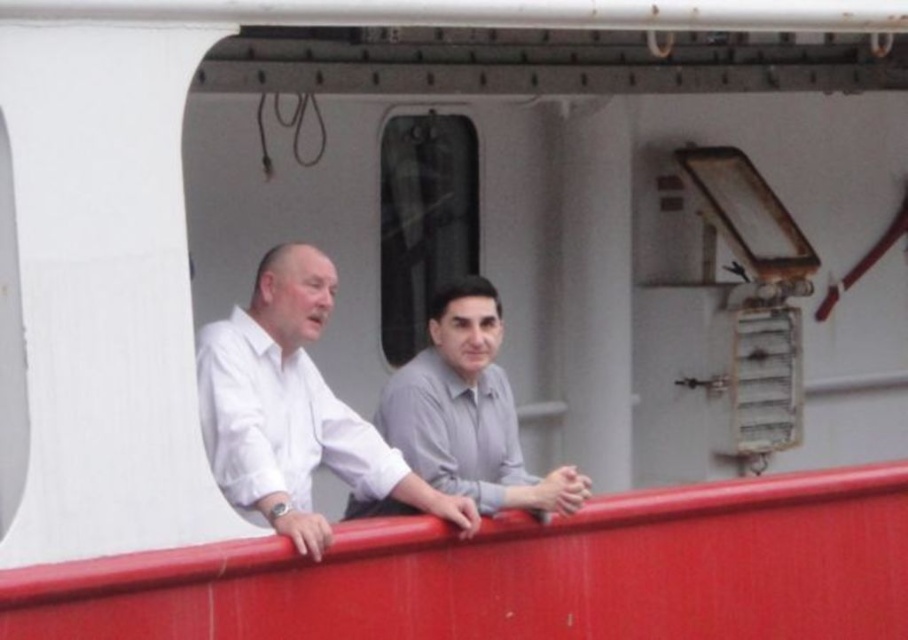
Is smooth glossy red rail at center further to camera compared to gray matte shirt at center?

That is False.

Which is more to the left, smooth glossy red rail at center or gray matte shirt at center?

Positioned to the left is gray matte shirt at center.

Who is more distant from viewer, (601, 531) or (522, 496)?

Positioned behind is point (601, 531).

At what (x,y) coordinates should I click in order to perform the action: click on smooth glossy red rail at center. Please return your answer as a coordinate pair (x, y). Looking at the image, I should click on (521, 573).

Is white matte shirt at center taller than gray matte shirt at center?

Indeed, white matte shirt at center has a greater height compared to gray matte shirt at center.

Who is more forward, (314, 436) or (511, 435)?

Point (314, 436)

Locate an element on the screen. The width and height of the screenshot is (908, 640). white matte shirt at center is located at coordinates (293, 410).

From the picture: Who is more distant from viewer, [884,620] or [223,420]?

The point [884,620] is more distant.

Between smooth glossy red rail at center and white matte shirt at center, which one is positioned higher?

white matte shirt at center

What do you see at coordinates (521, 573) in the screenshot? I see `smooth glossy red rail at center` at bounding box center [521, 573].

The height and width of the screenshot is (640, 908). I want to click on smooth glossy red rail at center, so pos(521,573).